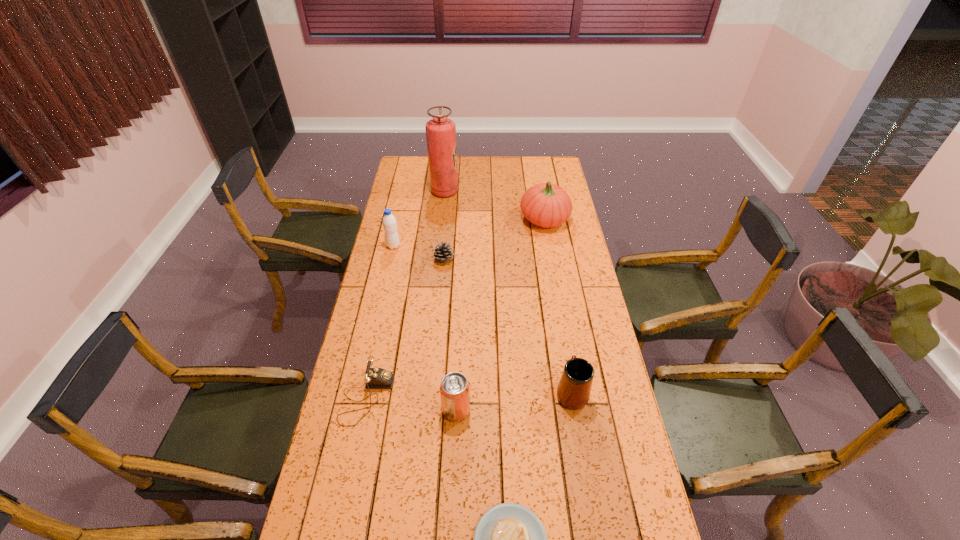
This screenshot has height=540, width=960. Identify the location of the tallest object. (440, 131).

Where is `the farthest object`? The width and height of the screenshot is (960, 540). the farthest object is located at coordinates (440, 131).

Find the location of a particular element. The height and width of the screenshot is (540, 960). the seventh nearest object is located at coordinates (547, 205).

You are a GUI agent. You are given a task and a screenshot of the screen. Output one action in this format:
    pyautogui.click(x=<x>, y=<y>)
    Task: Click on the third farthest object
    This screenshot has width=960, height=540.
    Given the screenshot: What is the action you would take?
    pyautogui.click(x=389, y=222)

Identify the location of mug. (573, 392).

Identify the location of soda can. (454, 389).

Image resolution: width=960 pixels, height=540 pixels. Find the location of `telephone`. telephone is located at coordinates coord(375,378).

Identify the location of the fifth nearest object. The image size is (960, 540). (442, 253).

Where is `vacant region located on the label side of the tallest object`? This screenshot has width=960, height=540. vacant region located on the label side of the tallest object is located at coordinates (519, 192).

Image resolution: width=960 pixels, height=540 pixels. Identify the location of vacant space situated 0.310m on the front of the second farthest object. (556, 284).